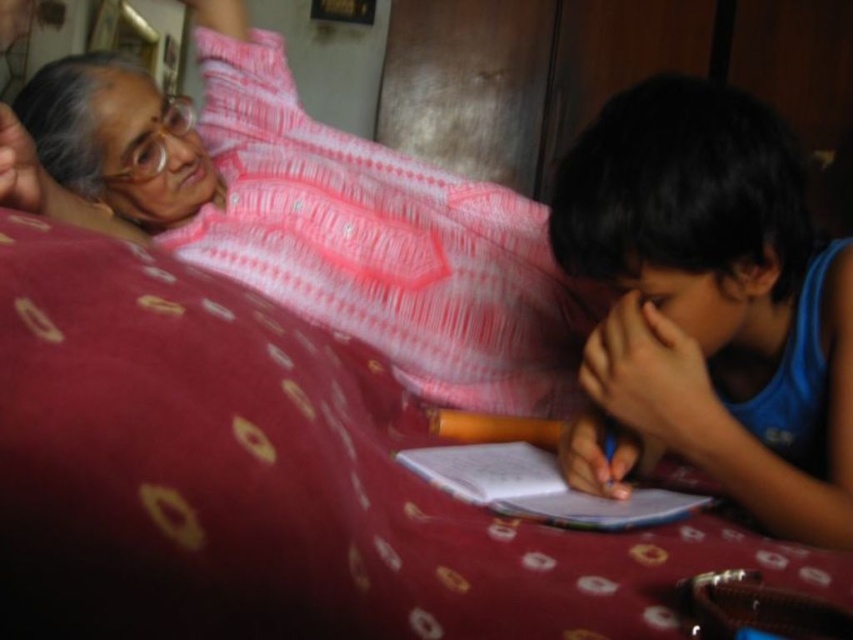
You are standing in the room and want to reach both the pink textured kurta at upper left and the blue cotton shirt at right. Which item will you need to walk closer to first?

You will need to walk closer to the blue cotton shirt at right first because the pink textured kurta at upper left is closer to you, so you can reach it without moving closer first.

You are organizing a clothing donation drive and need to know which item is wider between the pink textured kurta at upper left and the blue cotton shirt at right. Can you determine which one has a greater width?

The pink textured kurta at upper left is wider than the blue cotton shirt at right, as stated in the description that its width surpasses the latter.

You are standing in a room and see the patterned fabric bed at center. If you want to place a 10 inch wide book on the bed, will it fit entirely on the bed?

The distance between you and the patterned fabric bed at center is 8.71 inches, which indicates the bed is within reach. However, the question about the book fitting on the bed cannot be answered with the provided information since the bed dimensions are not specified in the objects description.